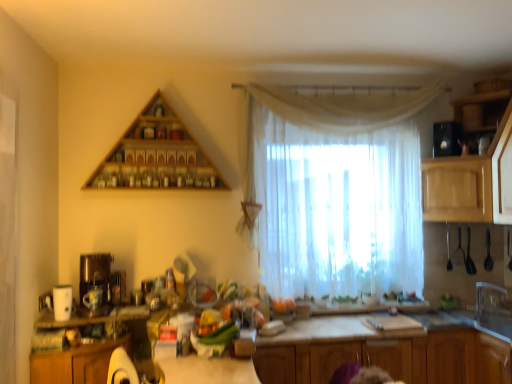
Question: In the image, is black glossy microwave at upper right, the third appliance viewed from the front, on the left side or the right side of clear plastic faucet at right?

Choices:
 (A) right
 (B) left

Answer: (B)

Question: From a real-world perspective, relative to clear plastic faucet at right, is black glossy microwave at upper right, which ranks as the 1th appliance in back-to-front order, vertically above or below?

Choices:
 (A) below
 (B) above

Answer: (B)

Question: Based on their relative distances, which object is nearer to the wooden cabinets at center, acting as the second cabinetry starting from the left?

Choices:
 (A) black glossy microwave at upper right, which is the first appliance from top to bottom
 (B) light brown wood cabinet at right, acting as the 3th cabinetry starting from the right
 (C) wooden cabinet at lower left, the fifth cabinetry from the right
 (D) clear plastic faucet at right
 (E) wooden cabinet at lower right, placed as the 4th cabinetry when sorted from left to right

Answer: (E)

Question: Which object is positioned farthest from the white sheer curtain at center?

Choices:
 (A) wooden triangle at upper center
 (B) wooden cabinet at lower right, placed as the 4th cabinetry when sorted from left to right
 (C) white matte coffee maker at left, the 3th appliance positioned from the right
 (D) black glossy microwave at upper right, which ranks as the 1th appliance in back-to-front order
 (E) light brown wood cabinet at right, acting as the 3th cabinetry starting from the right

Answer: (C)